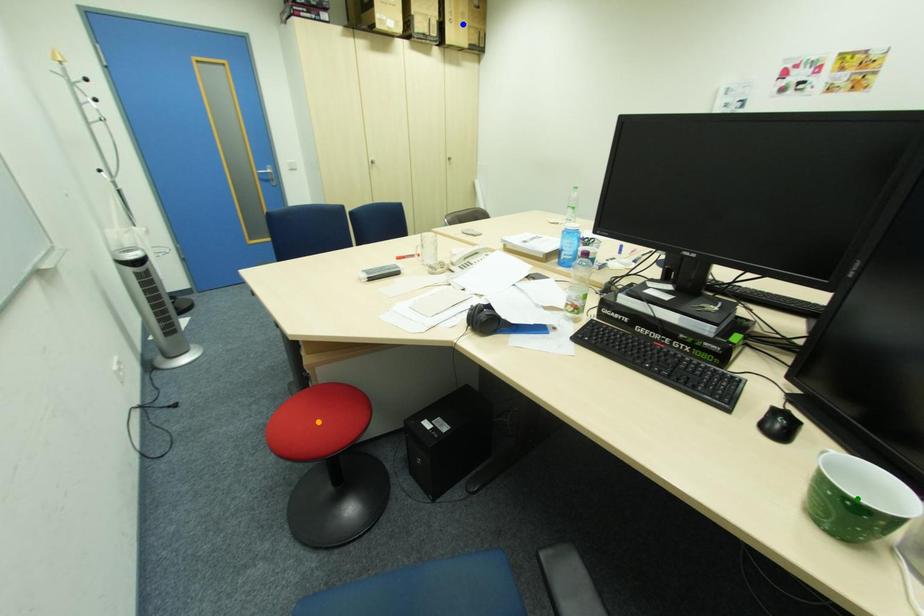
Order these from nearest to farthest:
green point
orange point
blue point

green point < orange point < blue point